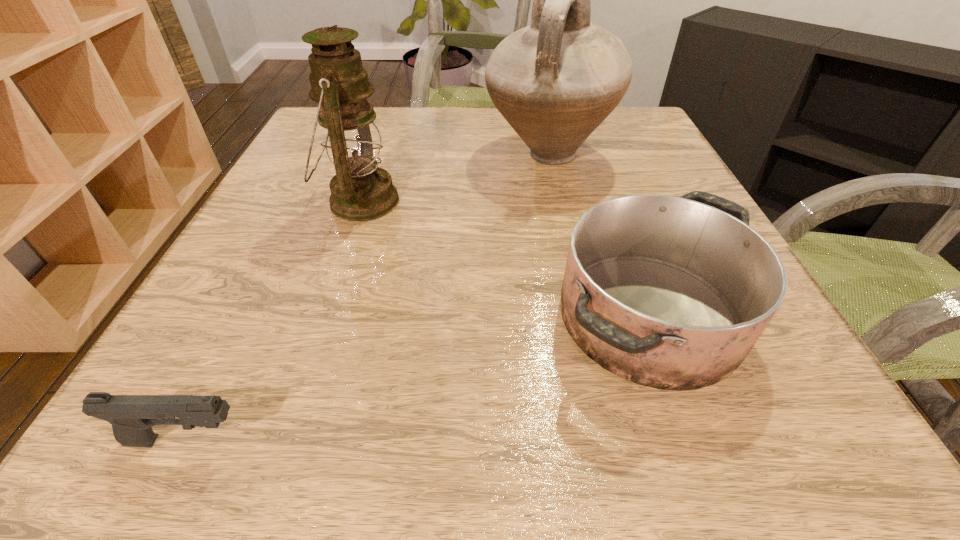
Identify the location of unoccupied area between the third tallest object and the pistol. Image resolution: width=960 pixels, height=540 pixels. (418, 379).

Locate an element on the screen. free point between the oil lamp and the third farthest object is located at coordinates (505, 259).

This screenshot has height=540, width=960. Find the location of `vacant area that lies between the nearest object and the oil lamp`. vacant area that lies between the nearest object and the oil lamp is located at coordinates (x=274, y=321).

Where is `vacant area that lies between the pistol and the pitcher`? The height and width of the screenshot is (540, 960). vacant area that lies between the pistol and the pitcher is located at coordinates (368, 298).

Point out which object is positioned as the nearest to the oil lamp. Please provide its 2D coordinates. Your answer should be formatted as a tuple, i.e. [(x, y)], where the tuple contains the x and y coordinates of a point satisfying the conditions above.

[(555, 81)]

Identify which object is the third nearest to the shortest object. Please provide its 2D coordinates. Your answer should be formatted as a tuple, i.e. [(x, y)], where the tuple contains the x and y coordinates of a point satisfying the conditions above.

[(555, 81)]

I want to click on vacant position in the image that satisfies the following two spatial constraints: 1. on the handle side of the pitcher; 2. at the barrel of the shortest object, so click(612, 441).

At what (x,y) coordinates should I click in order to perform the action: click on free spot that satisfies the following two spatial constraints: 1. on the handle side of the second nearest object; 2. on the right side of the pitcher. Please return your answer as a coordinate pair (x, y). Looking at the image, I should click on (584, 316).

In order to click on vacant space that satisfies the following two spatial constraints: 1. on the handle side of the pitcher; 2. at the barrel of the pistol in this screenshot , I will do `click(612, 441)`.